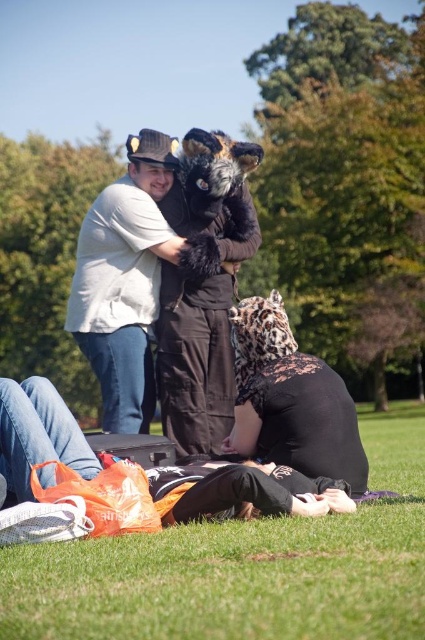
Can you confirm if green grass at lower center is taller than leopard print fabric at lower center?

No, green grass at lower center is not taller than leopard print fabric at lower center.

Which is more to the left, green grass at lower center or leopard print fabric at lower center?

From the viewer's perspective, leopard print fabric at lower center appears more on the left side.

The image size is (425, 640). Describe the element at coordinates (243, 568) in the screenshot. I see `green grass at lower center` at that location.

Where is `green grass at lower center`? This screenshot has width=425, height=640. green grass at lower center is located at coordinates (243, 568).

Who is lower down, green grass at lower center or white cotton shirt at center?

green grass at lower center is lower down.

Does point (360, 515) come closer to viewer compared to point (155, 240)?

Yes, it is in front of point (155, 240).

You are a GUI agent. You are given a task and a screenshot of the screen. Output one action in this format:
    pyautogui.click(x=<x>, y=<y>)
    Task: Click on the green grass at lower center
    The width and height of the screenshot is (425, 640).
    Given the screenshot: What is the action you would take?
    pyautogui.click(x=243, y=568)

Who is positioned more to the left, white cotton shirt at center or leopard print fabric at lower center?

From the viewer's perspective, white cotton shirt at center appears more on the left side.

Looking at this image, measure the distance between white cotton shirt at center and camera.

They are 7.05 meters apart.

Which is in front, point (164, 163) or point (257, 388)?

Point (257, 388) is more forward.

Find the location of a particular element. Image resolution: width=425 pixels, height=640 pixels. white cotton shirt at center is located at coordinates (124, 280).